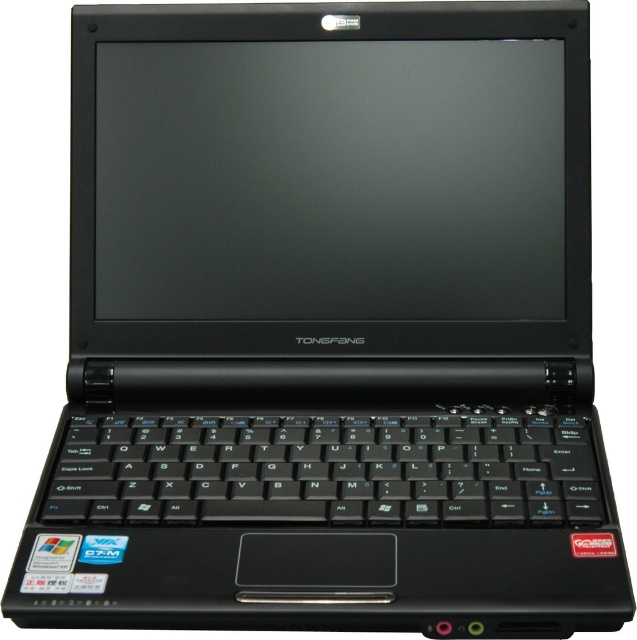
Question: Which object appears closest to the camera in this image?

Choices:
 (A) black matte screen at center
 (B) black plastic keyboard at center

Answer: (B)

Question: Is black matte screen at center in front of black plastic keyboard at center?

Choices:
 (A) no
 (B) yes

Answer: (A)

Question: Does black matte screen at center appear on the right side of black plastic keyboard at center?

Choices:
 (A) yes
 (B) no

Answer: (A)

Question: Among these objects, which one is nearest to the camera?

Choices:
 (A) black matte screen at center
 (B) black plastic keyboard at center

Answer: (B)

Question: Which object appears closest to the camera in this image?

Choices:
 (A) black matte screen at center
 (B) black plastic keyboard at center

Answer: (B)

Question: Where is black matte screen at center located in relation to black plastic keyboard at center in the image?

Choices:
 (A) right
 (B) left

Answer: (A)